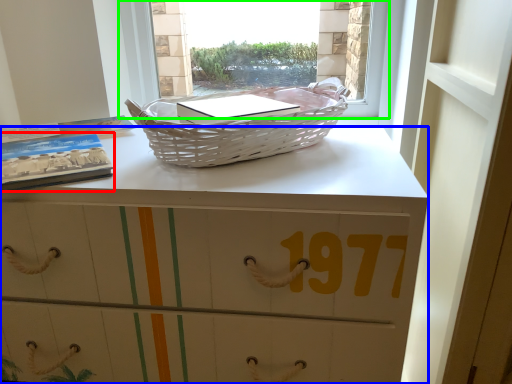
Question: Which object is the farthest from paperback book (highlighted by a red box)? Choose among these: desk (highlighted by a blue box) or window (highlighted by a green box).

Choices:
 (A) desk
 (B) window

Answer: (B)